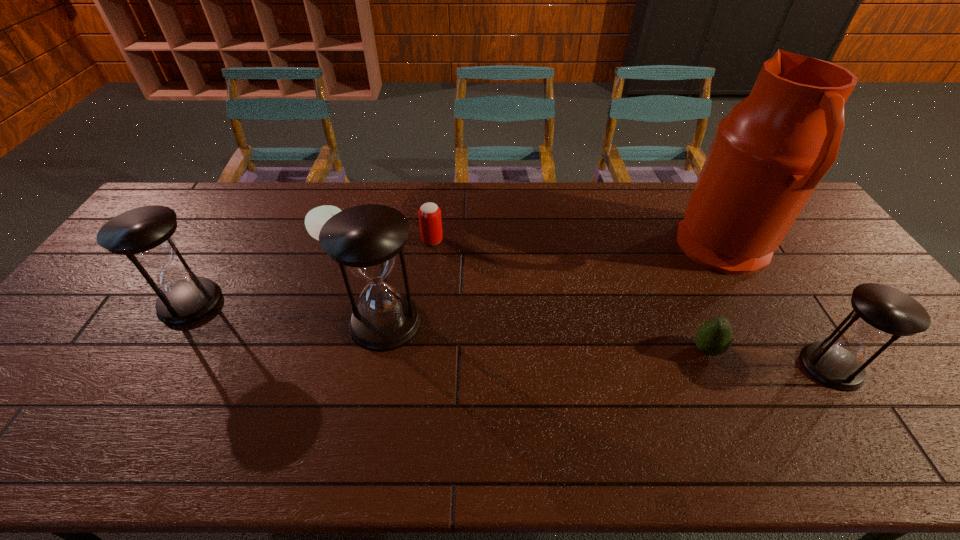
Image resolution: width=960 pixels, height=540 pixels. I want to click on the third tallest object, so click(144, 234).

What are the coordinates of `the leftmost object` in the screenshot? It's located at (144, 234).

This screenshot has height=540, width=960. I want to click on the second hourglass from right to left, so click(366, 238).

You are a GUI agent. You are given a task and a screenshot of the screen. Output one action in this format:
    pyautogui.click(x=<x>, y=<y>)
    Task: Click on the fourth tallest object
    The height and width of the screenshot is (540, 960).
    Given the screenshot: What is the action you would take?
    pyautogui.click(x=880, y=313)

What are the coordinates of `the rightmost hourglass` in the screenshot? It's located at tap(880, 313).

I want to click on beer can, so coord(429,213).

The image size is (960, 540). I want to click on water jug, so click(x=770, y=152).

Find the location of a particular element. The height and width of the screenshot is (540, 960). the second object from left to right is located at coordinates (316, 218).

Where is `avocado`? This screenshot has width=960, height=540. avocado is located at coordinates (714, 337).

Identify the location of free space located on the back of the third tallest object. (251, 200).